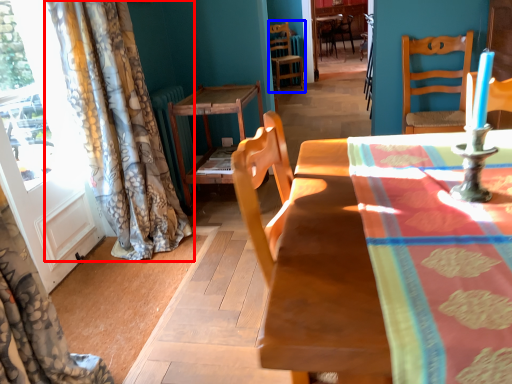
Question: Which object is further to the camera taking this photo, curtain (highlighted by a red box) or chair (highlighted by a blue box)?

Choices:
 (A) curtain
 (B) chair

Answer: (B)